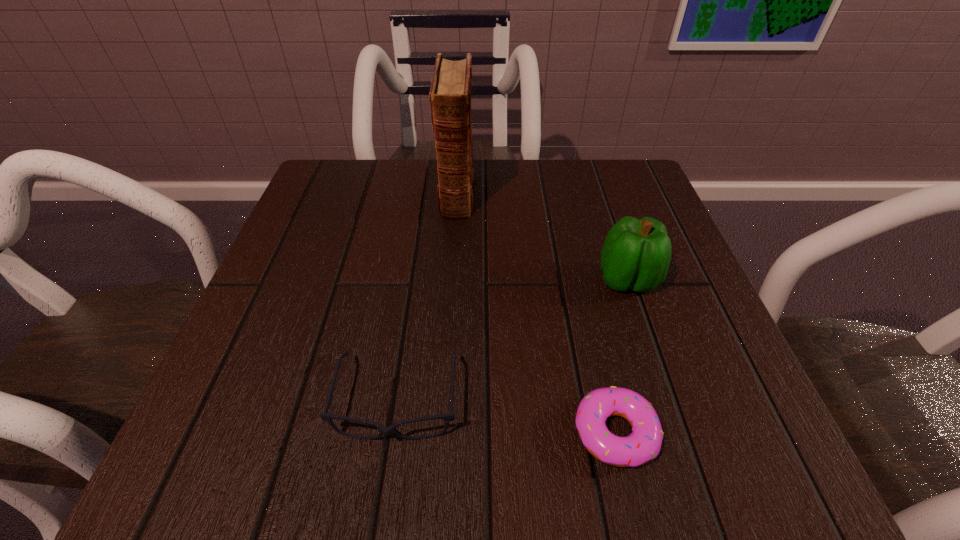
The image size is (960, 540). I want to click on hardback book, so click(450, 92).

Identify the location of the tallest object. The width and height of the screenshot is (960, 540). (450, 92).

This screenshot has width=960, height=540. I want to click on the third nearest object, so click(636, 254).

I want to click on bell pepper, so click(x=636, y=254).

In order to click on spectacles in this screenshot , I will do `click(450, 416)`.

Find the location of a particular element. doughnut is located at coordinates (644, 443).

At what (x,y) coordinates should I click in order to perform the action: click on vacant point located 0.210m on the spine side of the farthest object. Please return your answer as a coordinate pair (x, y). The image size is (960, 540). Looking at the image, I should click on (450, 298).

The image size is (960, 540). I want to click on free space located 0.360m on the left of the third nearest object, so 391,280.

Locate an element on the screen. The width and height of the screenshot is (960, 540). free spot located 0.300m on the left of the shortest object is located at coordinates (341, 432).

Where is `object that is at the far edge`? The image size is (960, 540). object that is at the far edge is located at coordinates (450, 92).